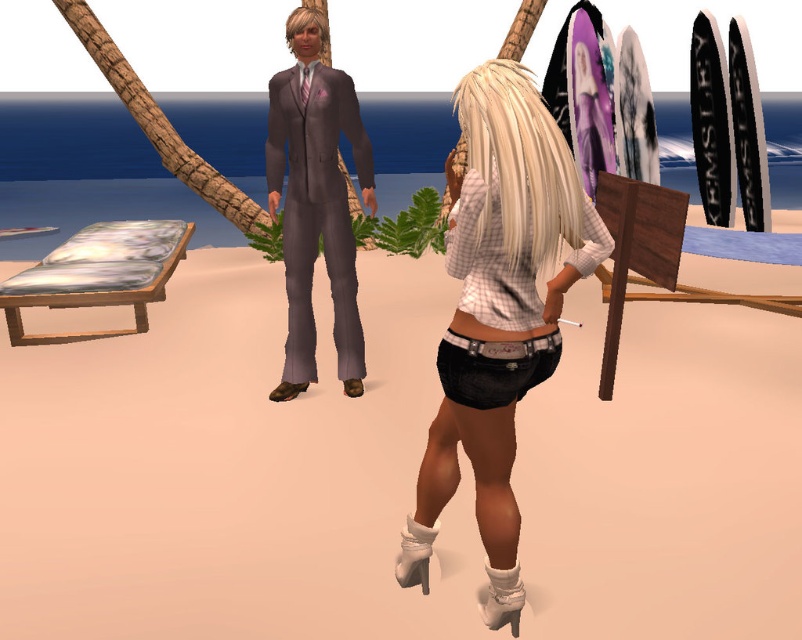
You are organizing a virtual fashion show in the beach scene. You need to place the denim shorts at center and the matte gray suit at center on the sandy ground. Since space is limited, which item should you choose to place first to ensure both can fit comfortably?

The denim shorts at center occupies less space than the matte gray suit at center, so you should place the denim shorts at center first to ensure both can fit comfortably.

You are navigating a drone that needs to drop a package at the beige sand at center. According to the coordinates provided, where exactly should the drone target?

The beige sand at center is located at coordinates point [229,468], so the drone should target that exact point to drop the package.

You are a photographer trying to capture the woman in the scene. You notice the beige sand at center and the denim shorts at center. Which object is closer to the camera?

The denim shorts at center are closer to the camera because they are taller than the beige sand at center.